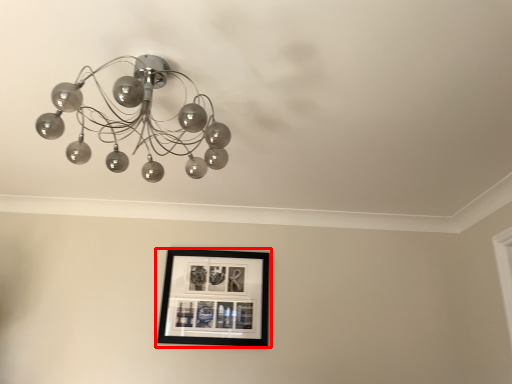
Question: From the image's perspective, where is picture frame (annotated by the red box) located relative to lamp?

Choices:
 (A) below
 (B) above

Answer: (A)